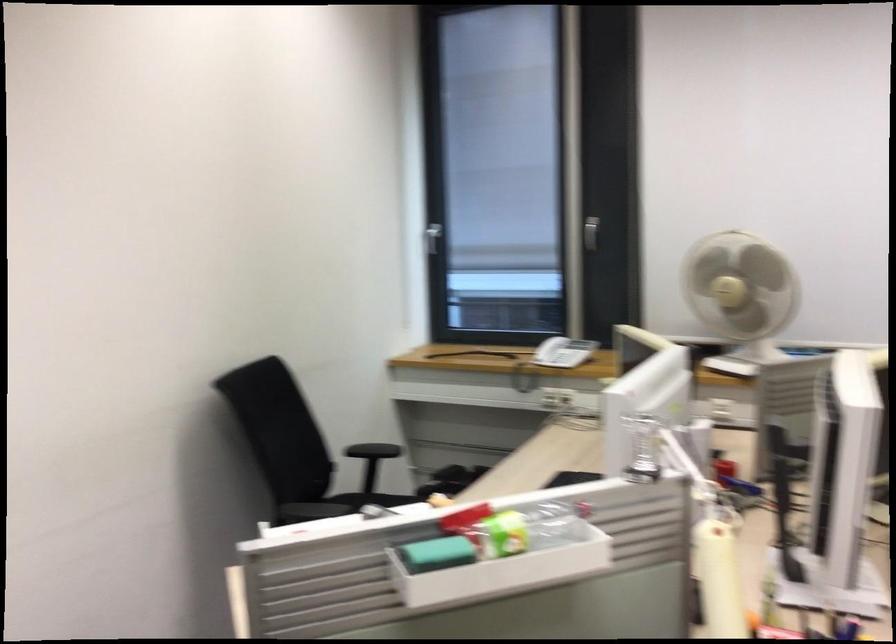
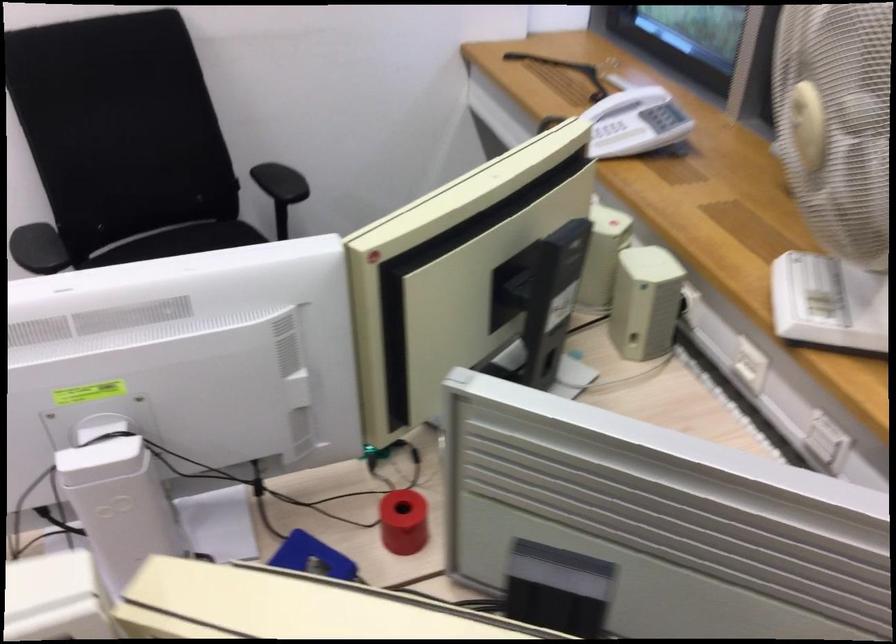
In the second image, find the point that corresponds to the point at 553,344 in the first image.

(612, 131)